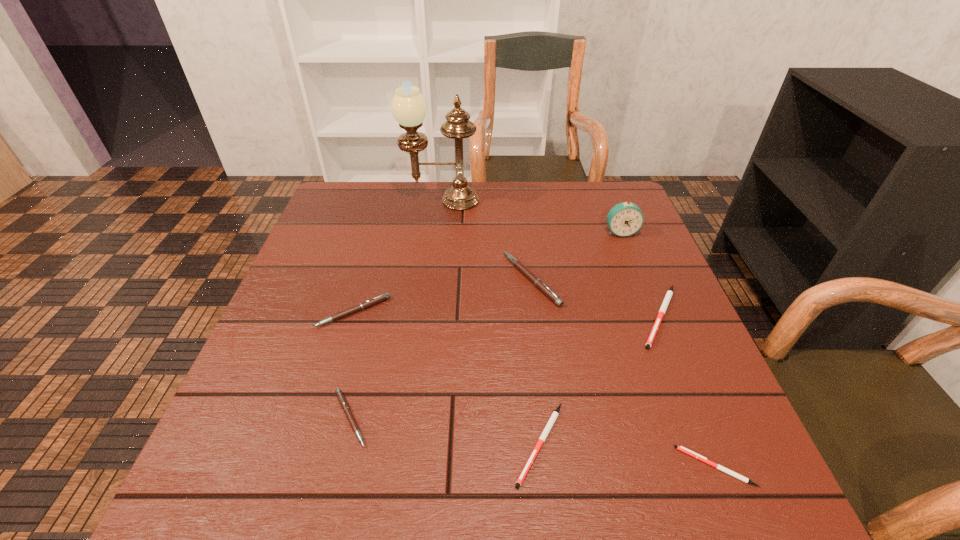
In the image, there is a desktop. Where is `vacant space at the near edge`? The height and width of the screenshot is (540, 960). vacant space at the near edge is located at coordinates click(x=486, y=503).

This screenshot has height=540, width=960. In order to click on vacant space at the right edge of the desktop in this screenshot , I will do `click(678, 436)`.

This screenshot has height=540, width=960. What are the coordinates of `vacant space at the far left corner of the desktop` in the screenshot? It's located at (371, 193).

Locate an element on the screen. This screenshot has height=540, width=960. vacant space at the far right corner of the desktop is located at coordinates (575, 191).

You are a GUI agent. You are given a task and a screenshot of the screen. Output one action in this format:
    pyautogui.click(x=<x>, y=<y>)
    Task: Click on the free point at the near right corner
    The height and width of the screenshot is (540, 960).
    Given the screenshot: What is the action you would take?
    pyautogui.click(x=738, y=468)

Where is `free space between the second smallest pink pen and the farthest white pen`? Image resolution: width=960 pixels, height=540 pixels. free space between the second smallest pink pen and the farthest white pen is located at coordinates (507, 314).

Locate an element on the screen. This screenshot has width=960, height=540. empty location between the blue alarm clock and the farthest white pen is located at coordinates (640, 274).

This screenshot has height=540, width=960. Identify the location of free point between the second tallest object and the smallest pink pen. (486, 325).

Image resolution: width=960 pixels, height=540 pixels. What are the coordinates of `unoccupied area between the second biggest pink pen and the farthest white pen` in the screenshot? It's located at (507, 314).

Locate an element on the screen. vacant point located between the shortest pen and the tallest object is located at coordinates (578, 334).